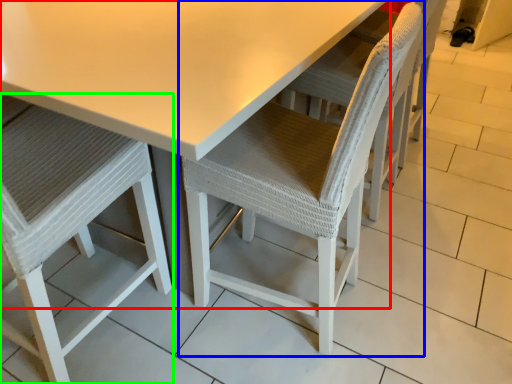
Question: Considering the real-world distances, which object is farthest from table (highlighted by a red box)? chair (highlighted by a blue box) or chair (highlighted by a green box)?

Choices:
 (A) chair
 (B) chair

Answer: (B)